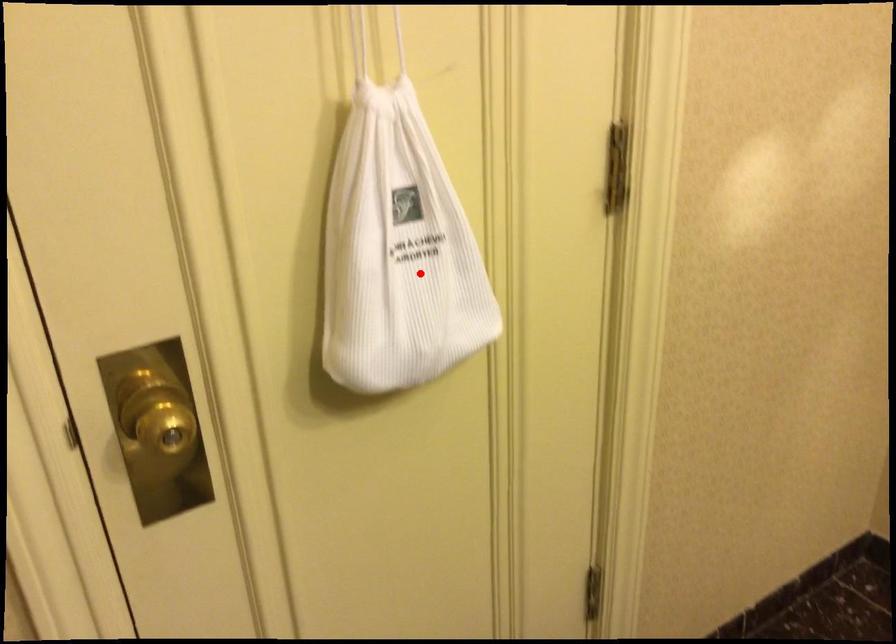
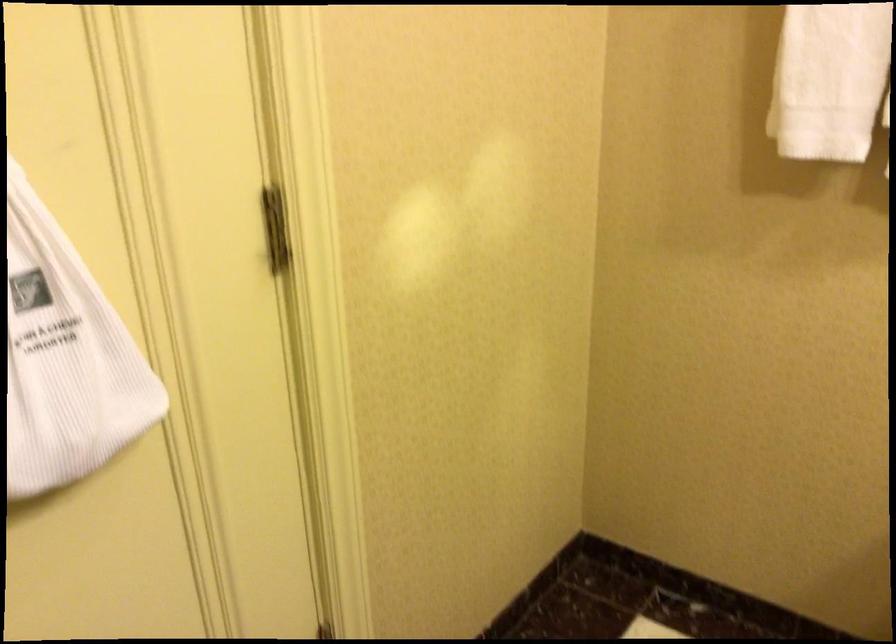
The point at the highlighted location is marked in the first image. Where is the corresponding point in the second image?

(65, 357)